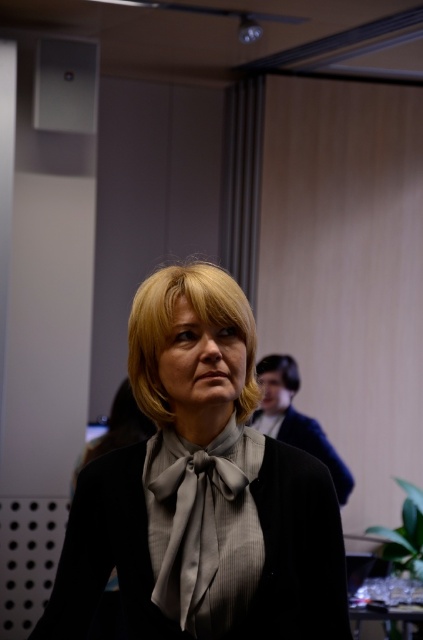
You are standing in an office and see two points marked in the image. Which point is closer to you, point (195, 326) or point (282, 371)?

Point (195, 326) is closer to the viewer than point (282, 371).

Based on the scene description, which object, the matte gray blouse at center or the blonde hair at upper right, occupies a larger vertical space in the image?

The matte gray blouse at center has a greater height compared to the blonde hair at upper right, so it occupies a larger vertical space in the image.